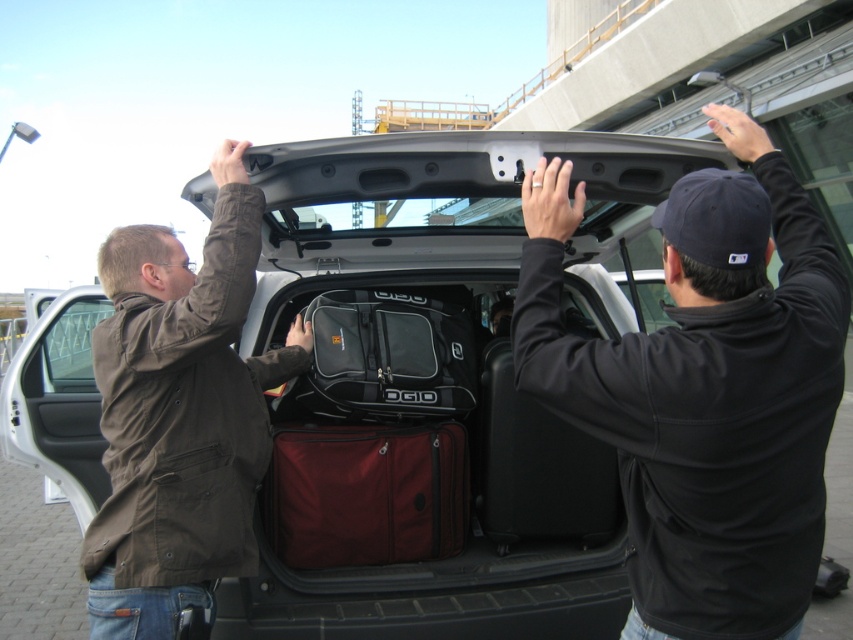
You are a photographer standing at the scene. You want to take a photo focusing on the black matte jacket at upper center and the brown fabric jacket at center. Which jacket will appear larger in the photo?

The black matte jacket at upper center will appear larger in the photo because it is closer to the viewer than the brown fabric jacket at center.

From the picture: You are a delivery robot positioned at the origin point of the coordinate system. You need to deliver a package to the point labeled as point (x=755, y=195) and then to point (x=200, y=592). Given that you can only move forward and backward along the path between these points, which point should you visit first to ensure you can reach both without needing to backtrack?

You should visit point (x=755, y=195) first because it is in front of point (x=200, y=592). Since you can only move forward and backward along the path, starting at the front point allows you to proceed to the subsequent point without needing to backtrack.